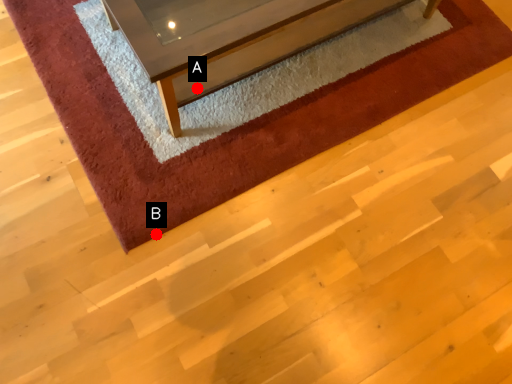
Question: Two points are circled on the image, labeled by A and B beside each circle. Which of the following is the farthest from the observer?

Choices:
 (A) A is further
 (B) B is further

Answer: (A)